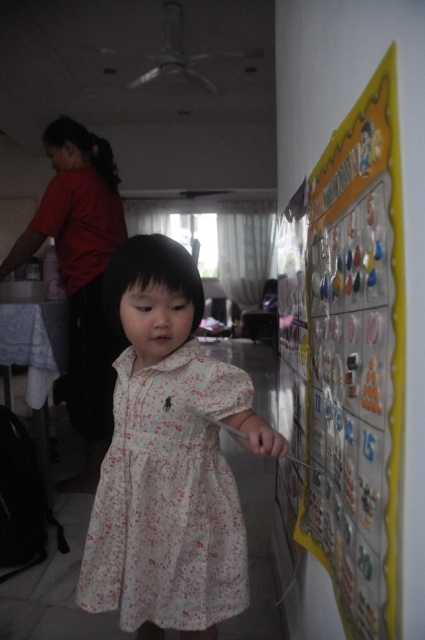
Is yellow paperboard at right bigger than white floral dress at center?

Incorrect, yellow paperboard at right is not larger than white floral dress at center.

Can you confirm if yellow paperboard at right is positioned above white floral dress at center?

Correct, yellow paperboard at right is located above white floral dress at center.

Where is `yellow paperboard at right`? The width and height of the screenshot is (425, 640). yellow paperboard at right is located at coordinates (356, 353).

Identify the location of yellow paperboard at right. The image size is (425, 640). point(356,353).